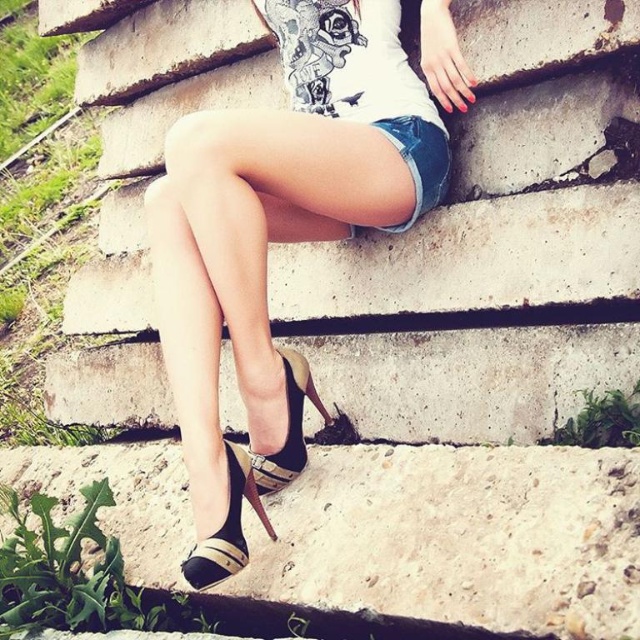
Between point (252, 259) and point (304, 376), which one is positioned in front?

Point (252, 259)

Between point (410, 170) and point (296, 456), which one is positioned in front?

Point (410, 170) is more forward.

This screenshot has height=640, width=640. What are the coordinates of `leather high heels at center` in the screenshot? It's located at (276, 237).

Does shiny gold sandal at center appear on the left side of denim shorts at center?

Correct, you'll find shiny gold sandal at center to the left of denim shorts at center.

Is shiny gold sandal at center below denim shorts at center?

Correct, shiny gold sandal at center is located below denim shorts at center.

Which is behind, point (282, 476) or point (419, 116)?

The point (419, 116) is more distant.

At what (x,y) coordinates should I click in order to perform the action: click on shiny gold sandal at center. Please return your answer as a coordinate pair (x, y). The image size is (640, 640). Looking at the image, I should click on (289, 428).

Does leather high heels at center appear on the right side of white printed t-shirt at center?

Incorrect, leather high heels at center is not on the right side of white printed t-shirt at center.

Who is taller, leather high heels at center or white printed t-shirt at center?

Standing taller between the two is leather high heels at center.

What are the coordinates of `leather high heels at center` in the screenshot? It's located at (276, 237).